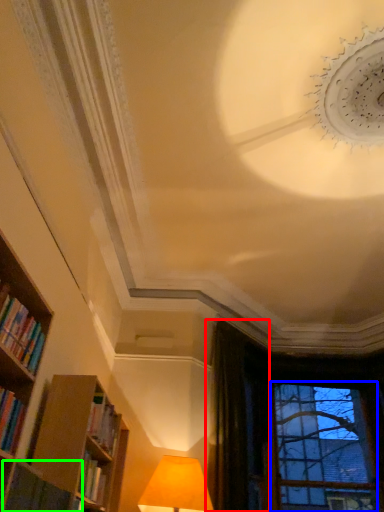
Question: Considering the real-world distances, which object is closest to curtain (highlighted by a red box)? bay window (highlighted by a blue box) or book (highlighted by a green box).

Choices:
 (A) bay window
 (B) book

Answer: (A)